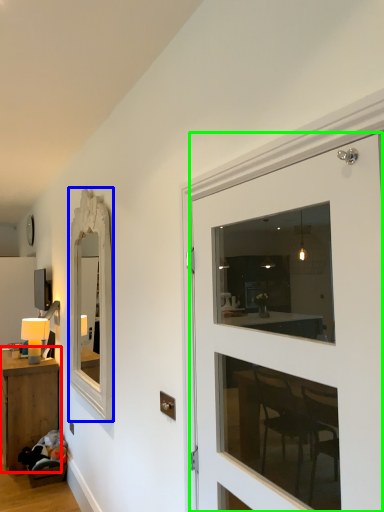
Question: Which object is positioned closest to table (highlighted by a red box)? Select from mirror (highlighted by a blue box) and door (highlighted by a green box).

Choices:
 (A) mirror
 (B) door

Answer: (A)